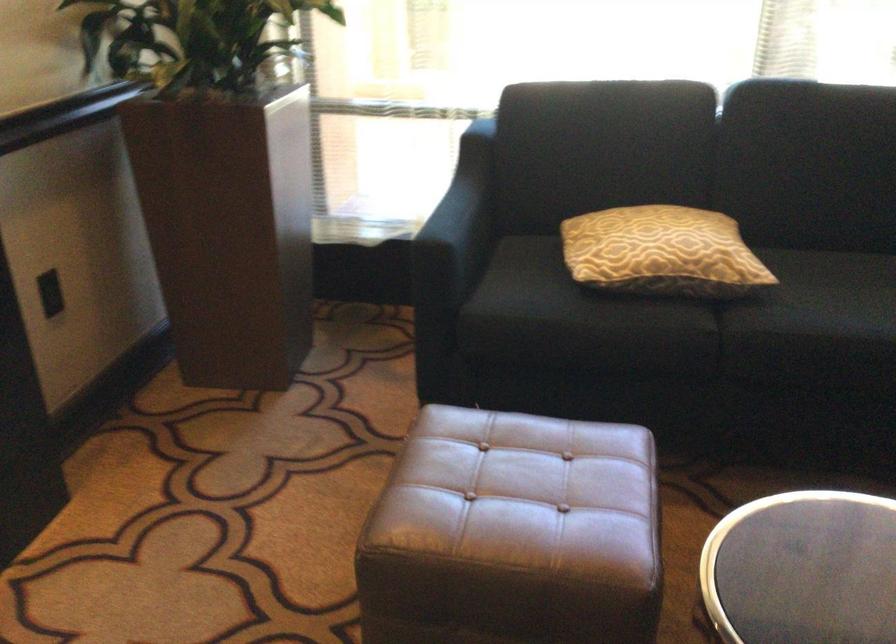
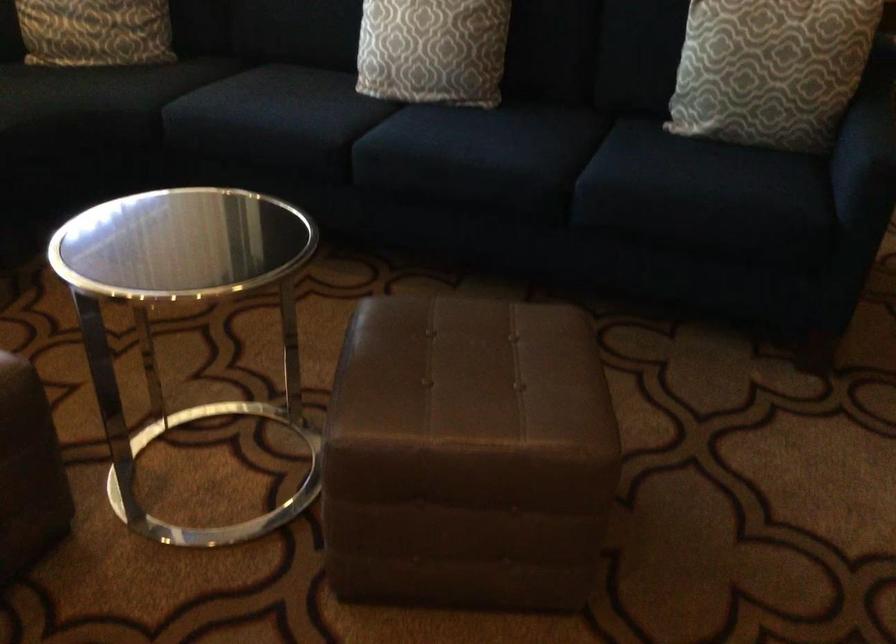
Based on the continuous images, in which direction is the camera rotating?

The rotation direction of the camera is right-down.